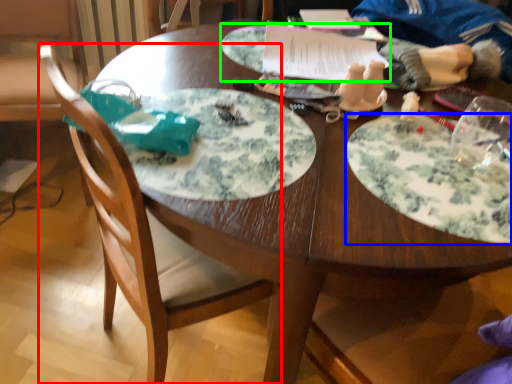
Question: Which object is the closest to the chair (highlighted by a red box)? Choose among these: plate (highlighted by a blue box) or platter (highlighted by a green box).

Choices:
 (A) plate
 (B) platter

Answer: (A)